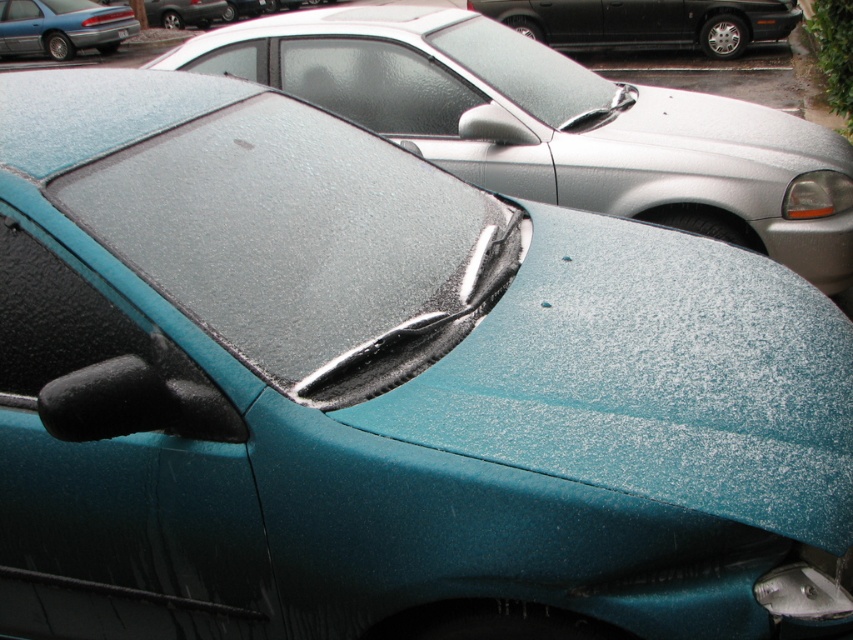
Question: Can you confirm if glossy plastic windshield at center is positioned below clear glass windshield at center?

Choices:
 (A) yes
 (B) no

Answer: (A)

Question: Does glossy plastic windshield at center appear on the right side of teal glossy car at center?

Choices:
 (A) no
 (B) yes

Answer: (A)

Question: Can you confirm if glossy plastic windshield at center is positioned to the right of teal glossy sedan at upper left?

Choices:
 (A) yes
 (B) no

Answer: (A)

Question: Estimate the real-world distances between objects in this image. Which object is farther from the teal glossy sedan at upper left?

Choices:
 (A) glossy plastic windshield at center
 (B) frosted glass windshield at center
 (C) clear glass windshield at center

Answer: (A)

Question: Which point is farther to the camera?

Choices:
 (A) clear glass windshield at center
 (B) frosted glass windshield at center

Answer: (B)

Question: Which object is positioned farthest from the glossy plastic windshield at center?

Choices:
 (A) glossy black car at upper center
 (B) black plastic license plate at center

Answer: (B)